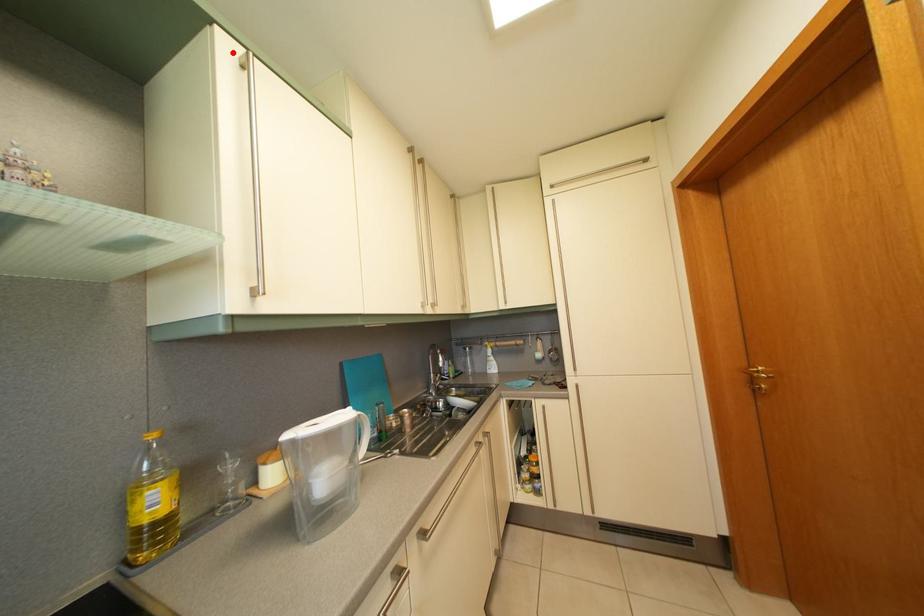
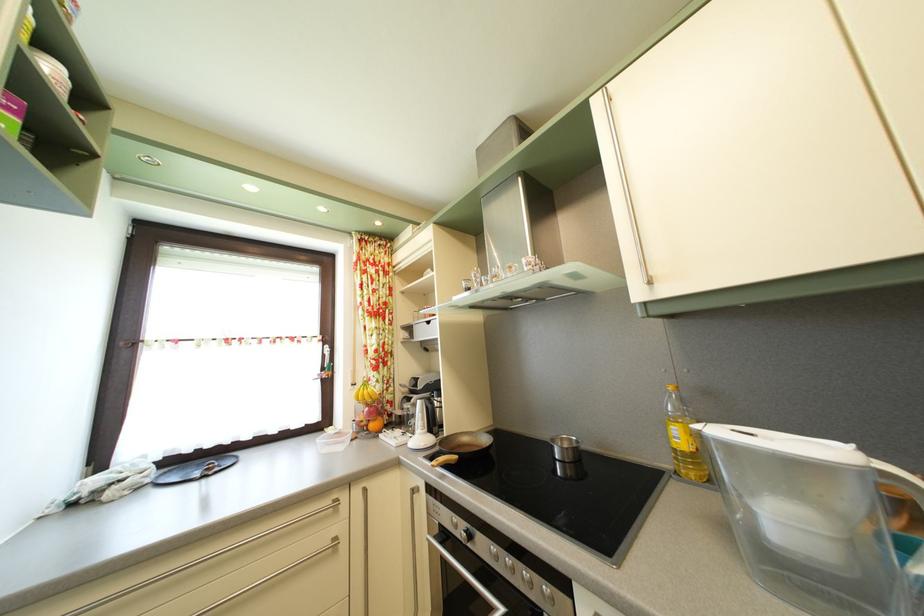
Locate, in the second image, the point that corresponds to the highlighted location in the first image.

(604, 111)